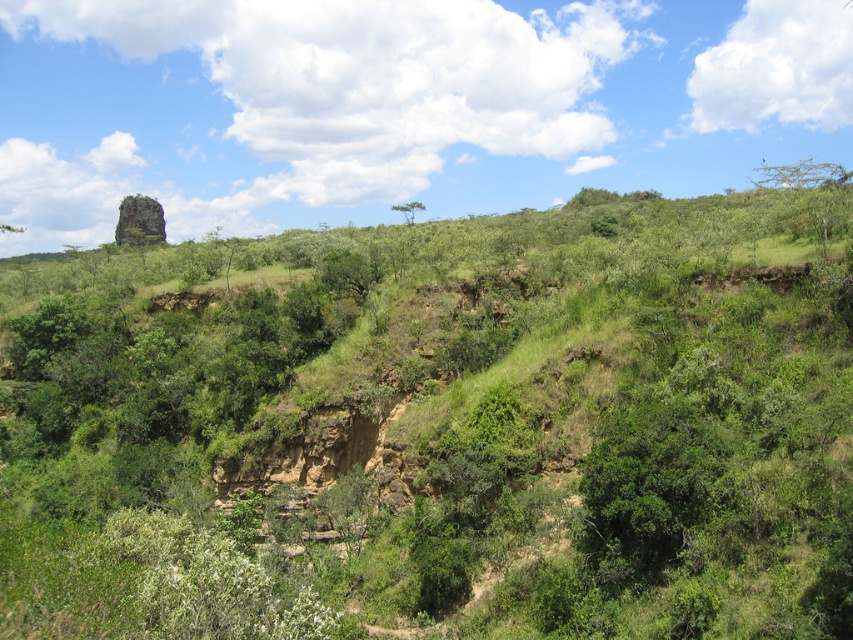
You are an environmental researcher studying tree growth patterns in this landscape. You observe the green leafy tree at upper right and the green leafy tree at center. Which tree would you expect to cast a longer shadow during midday? Please explain your reasoning based on their positions and the scene description.

The green leafy tree at upper right is taller than the green leafy tree at center. Since taller trees generally cast longer shadows, the green leafy tree at upper right would cast a longer shadow during midday.

You are an environmental scientist examining this landscape. You notice two trees marked as green leafy tree at upper right and green leafy tree at center. Which tree is located to the right of the other?

The green leafy tree at upper right is positioned on the right side of the green leafy tree at center.

You are a hiker trying to navigate through the rugged terrain in the foreground. You notice two landmarks to help you orient yourself. The first is the green leafy tree at upper right, and the second is the green leafy tree at center. Which of these two trees is wider in size?

The green leafy tree at upper right is wider in size than the green leafy tree at center.